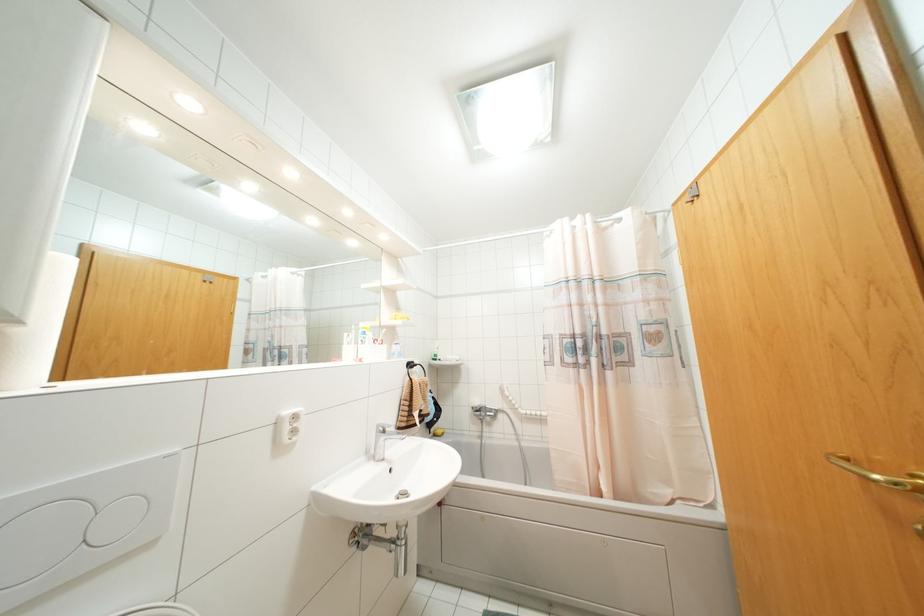
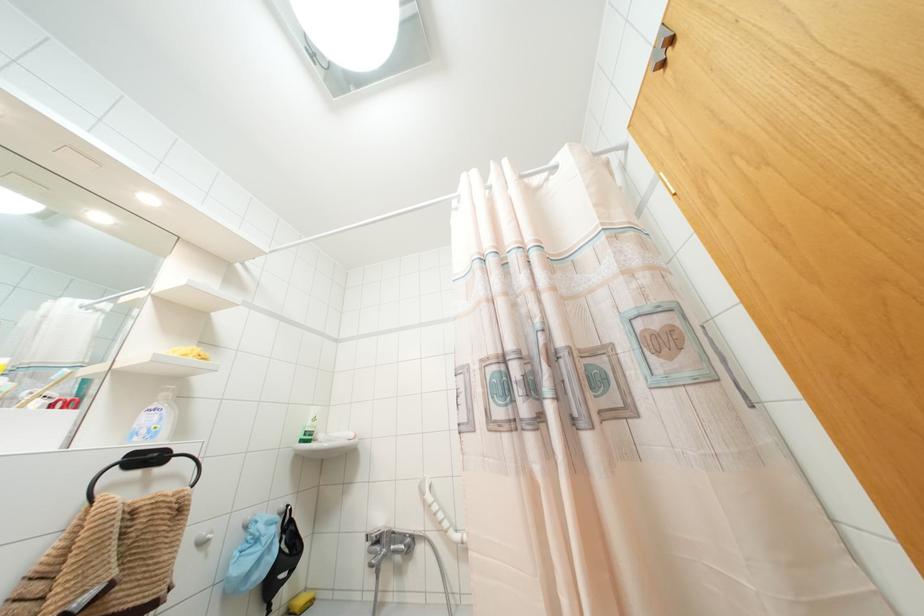
Which direction would the cameraman need to move to produce the second image?

The cameraman walked toward right, forward.